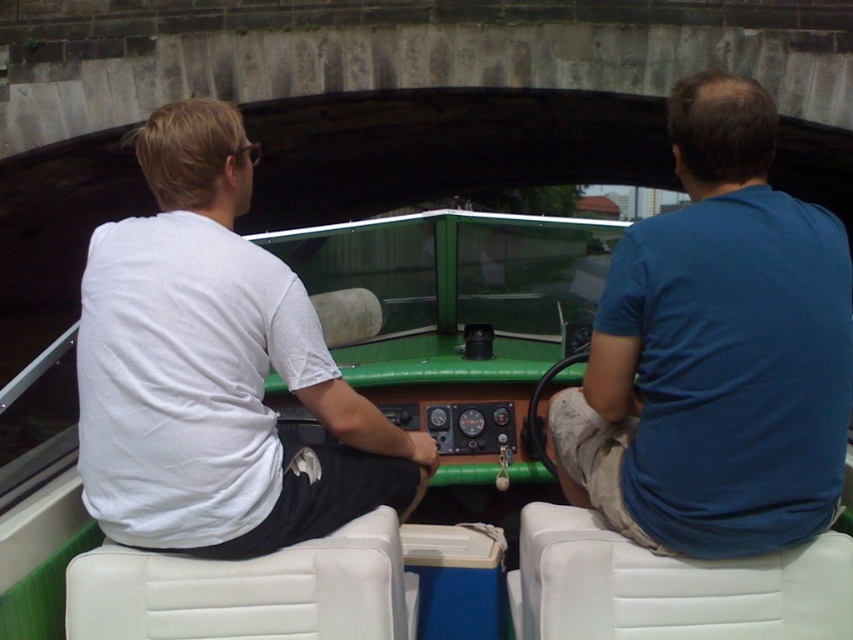
Between blue cotton shirt at right and white cotton shirt at left, which one appears on the left side from the viewer's perspective?

Positioned to the left is white cotton shirt at left.

Is blue cotton shirt at right wider than white cotton shirt at left?

Incorrect, blue cotton shirt at right's width does not surpass white cotton shirt at left's.

The image size is (853, 640). Describe the element at coordinates (717, 352) in the screenshot. I see `blue cotton shirt at right` at that location.

The image size is (853, 640). I want to click on blue cotton shirt at right, so click(717, 352).